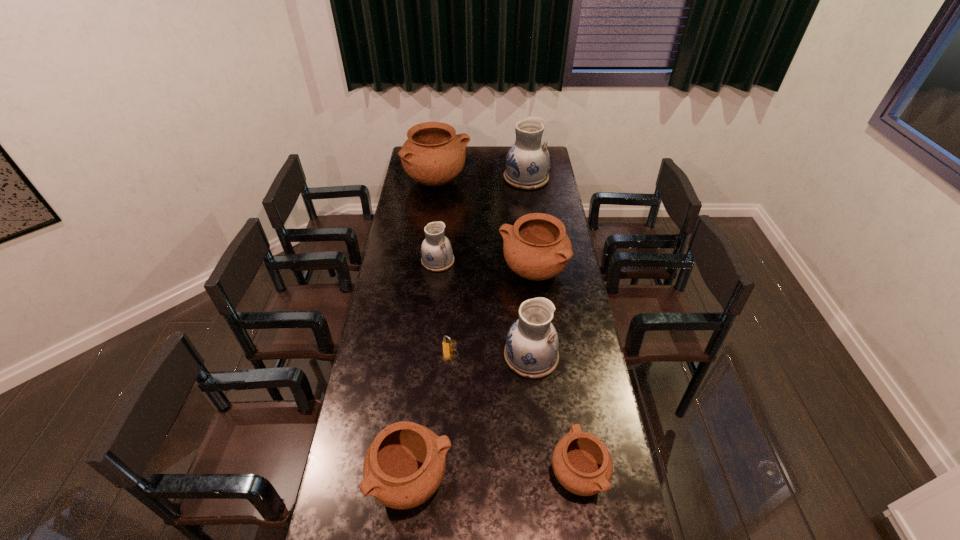
Locate an element on the screen. Image resolution: width=960 pixels, height=540 pixels. vacant space that satisfies the following two spatial constraints: 1. on the side with the combination dials of the seventh tallest object; 2. on the right side of the shortest object is located at coordinates (443, 472).

Find the location of `vacant space that satisfies the following two spatial constraints: 1. on the front side of the smallest blue pottery; 2. on the right side of the third nearest terracotta pottery`. vacant space that satisfies the following two spatial constraints: 1. on the front side of the smallest blue pottery; 2. on the right side of the third nearest terracotta pottery is located at coordinates (437, 271).

This screenshot has height=540, width=960. What are the coordinates of `vacant region that satisfies the following two spatial constraints: 1. on the side with the combination dials of the shortest object; 2. on the right side of the third nearest pottery` in the screenshot? It's located at (449, 355).